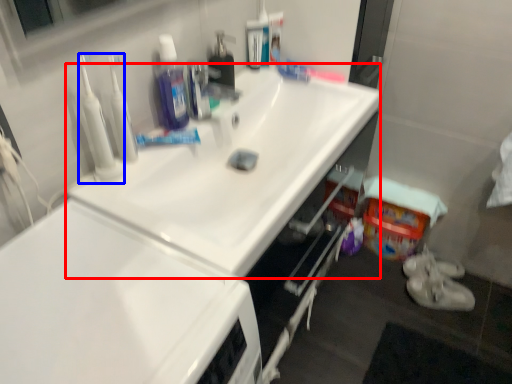
Question: Among these objects, which one is farthest to the camera, sink (highlighted by a red box) or cleanser (highlighted by a blue box)?

Choices:
 (A) sink
 (B) cleanser

Answer: (B)